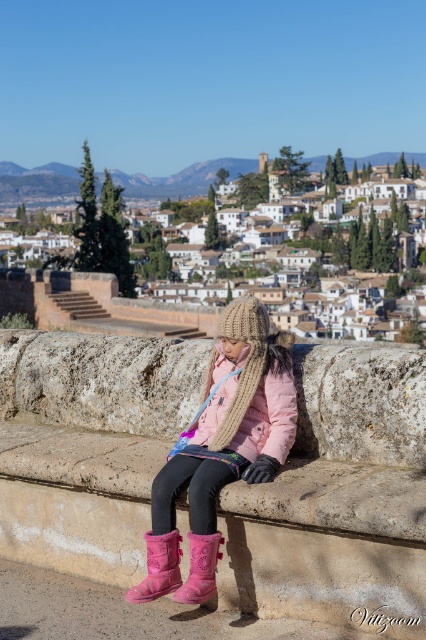
What are the coordinates of the pink suede boots at center in the image?

The coordinates of the pink suede boots at center are at point (221, 449).

You are a photographer trying to capture the young girl in the scene. If you want to focus on her pink suede boots at center, which are marked by the point at coordinates (221, 449), where should you aim your camera?

The point at coordinates (221, 449) marks the location of the pink suede boots at center, so aim your camera at that point to focus on them.

You are a photographer standing near the young girl on the stone bench. You want to capture a closeup shot of both the pink suede boots at center and the pink suede boot at lower left in the same frame. The camera you are using has a maximum focus range of 1.1 meters. Will you be able to include both boots in the photo without moving the camera?

The pink suede boots at center and the pink suede boot at lower left are 1.05 meters apart. Since the distance between them is within the camera maximum focus range of 1.1 meters, you can include both boots in the photo without moving the camera.